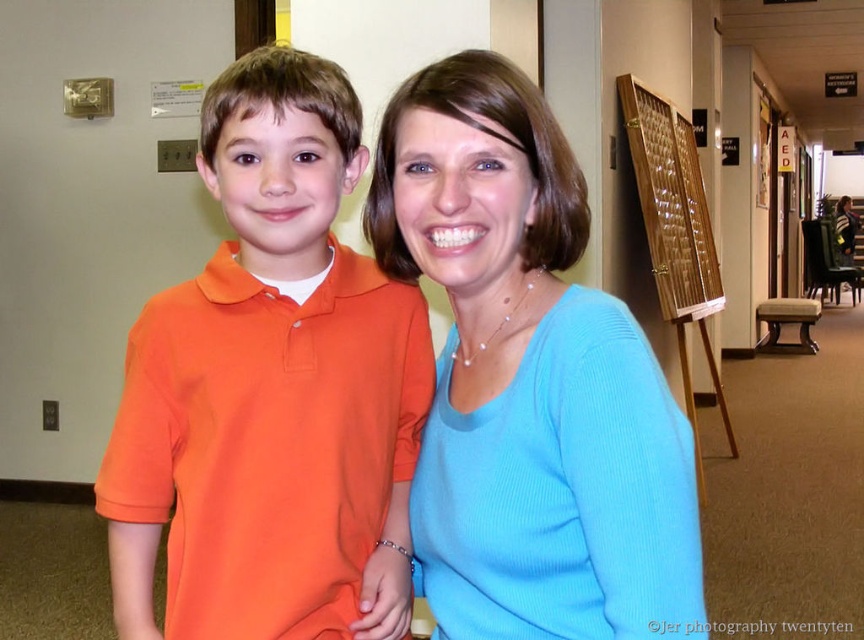
Question: Can you confirm if blue knit sweater at center is positioned above wooden textured board at right?

Choices:
 (A) yes
 (B) no

Answer: (B)

Question: Does matte orange shirt at left appear under blue knit sweater at center?

Choices:
 (A) yes
 (B) no

Answer: (B)

Question: Does matte orange shirt at left come in front of blue knit sweater at center?

Choices:
 (A) yes
 (B) no

Answer: (B)

Question: Which of the following is the farthest from the observer?

Choices:
 (A) wooden textured board at right
 (B) blue knit sweater at center
 (C) matte orange shirt at left

Answer: (A)

Question: Among these objects, which one is nearest to the camera?

Choices:
 (A) matte orange shirt at left
 (B) blue knit sweater at center

Answer: (B)

Question: Considering the real-world distances, which object is closest to the matte orange shirt at left?

Choices:
 (A) blue knit sweater at center
 (B) wooden textured board at right

Answer: (A)